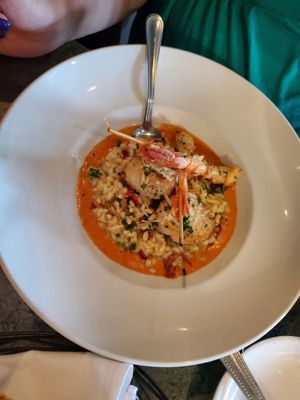
I want to click on plates, so click(x=26, y=176), click(x=279, y=359).